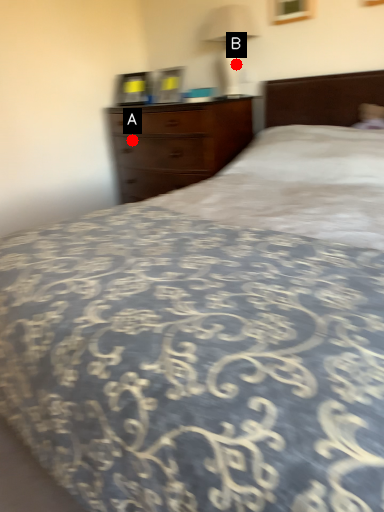
Question: Two points are circled on the image, labeled by A and B beside each circle. Among these points, which one is farthest from the camera?

Choices:
 (A) A is further
 (B) B is further

Answer: (A)